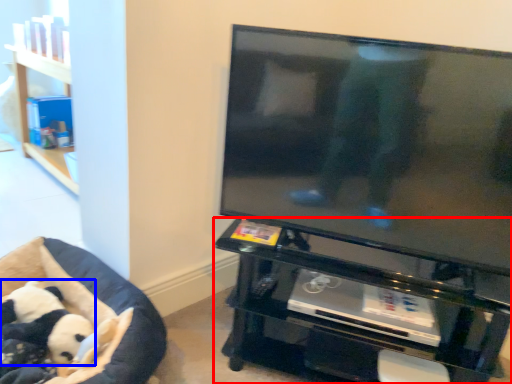
Question: Which of the following is the closest to the observer, furniture (highlighted by a red box) or panda (highlighted by a blue box)?

Choices:
 (A) furniture
 (B) panda

Answer: (A)